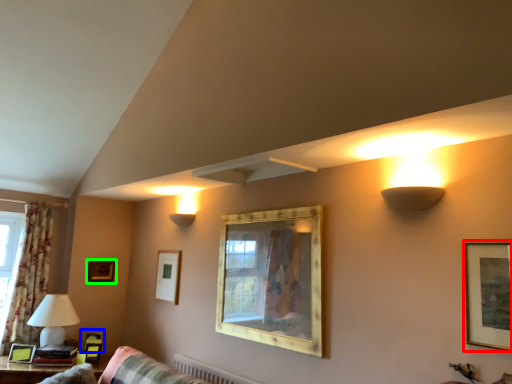
Question: Which is nearer to the picture frame (highlighted by a red box)? picture frame (highlighted by a blue box) or picture frame (highlighted by a green box).

Choices:
 (A) picture frame
 (B) picture frame

Answer: (A)